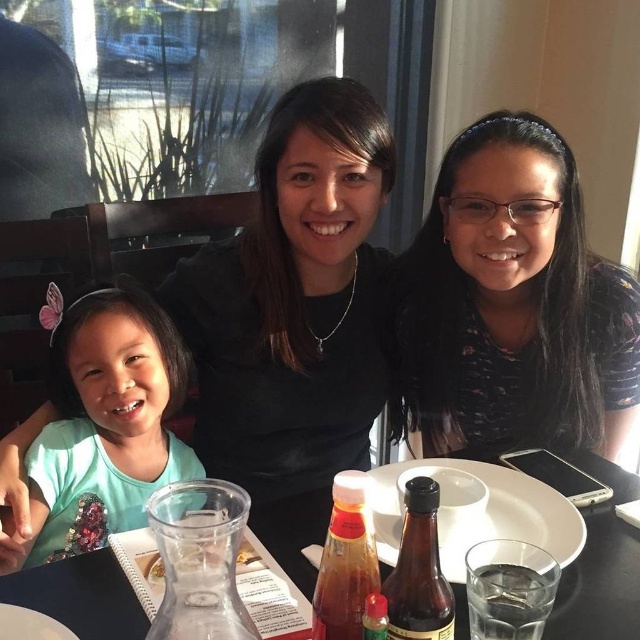
You are a waiter trying to serve a drink to the person wearing the black matte shirt at upper center. You have a tray with a clear glass carafe at lower left. Which object should you approach first to ensure you can reach the shirt wearer without obstacles?

You should approach the black matte shirt at upper center first because it is closer to you than the clear glass carafe at lower left, so you can reach the shirt wearer directly without needing to navigate around the carafe.

You are sitting at the table in the image and want to reach both the point at coordinate (17, 490) and the point at coordinate (93, 632). Which point will you reach first?

You will reach the point at coordinate (17, 490) first because it is closer to you than the point at coordinate (93, 632).

You are a server at the restaurant and need to determine which item takes up more space on the table. Which is larger between the black matte shirt at center and the clear glass carafe at lower left?

The black matte shirt at center is bigger than the clear glass carafe at lower left, so the black matte shirt at center takes up more space on the table.